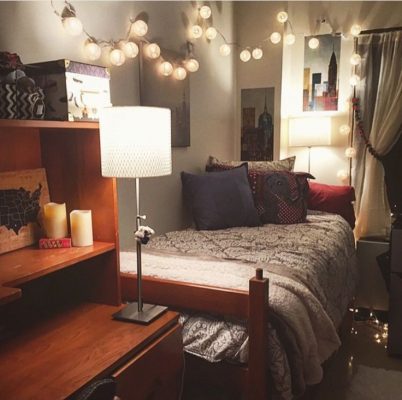
At what (x,y) coordinates should I click in order to perform the action: click on blankets. Please return your answer as a coordinate pair (x, y). The height and width of the screenshot is (400, 402). Looking at the image, I should click on (311, 335).